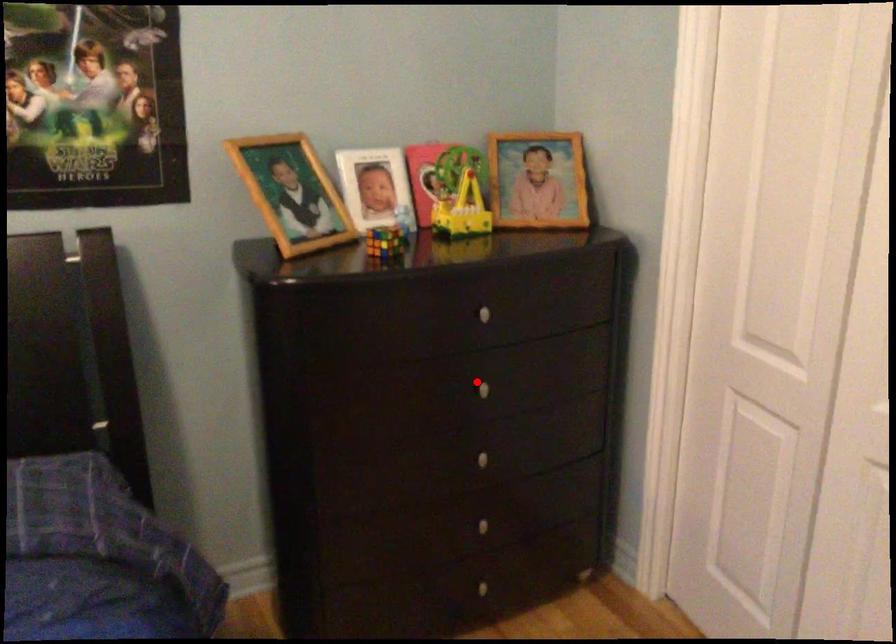
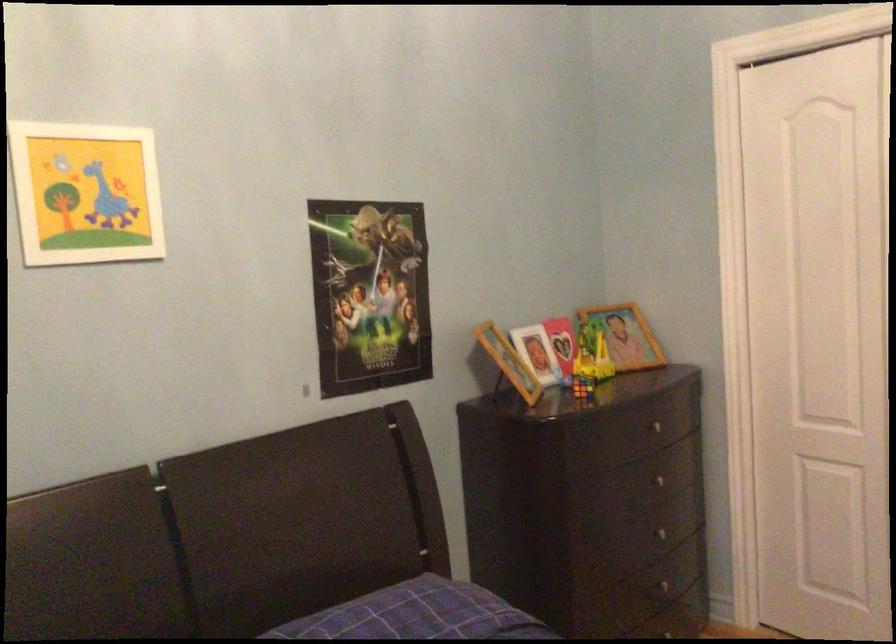
Question: I am providing you with two images of the same scene from different viewpoints. Image1 has a red point marked. In image2, the corresponding 3D location appears at what relative position? Reply with the corresponding letter.

Choices:
 (A) Closer
 (B) Farther

Answer: (B)